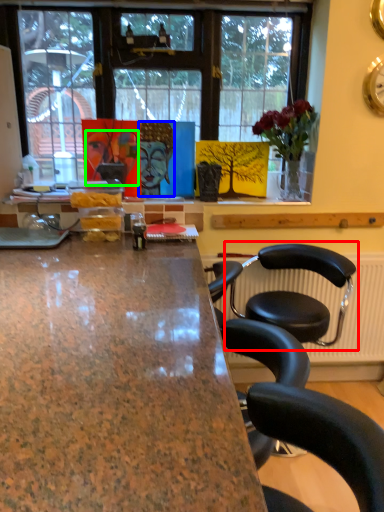
Question: Which is nearer to the chair (highlighted by a red box)? person (highlighted by a blue box) or human face (highlighted by a green box).

Choices:
 (A) person
 (B) human face

Answer: (A)